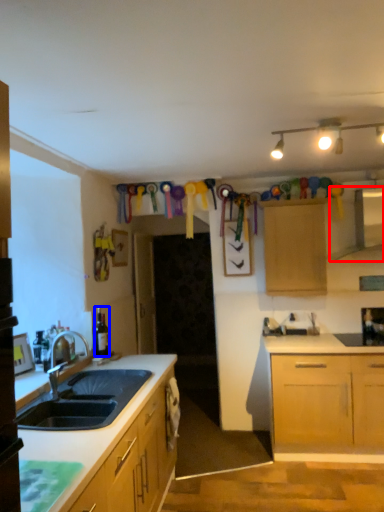
Question: Which point is closer to the camera, exhaust hood (highlighted by a red box) or bottle (highlighted by a blue box)?

Choices:
 (A) exhaust hood
 (B) bottle

Answer: (B)